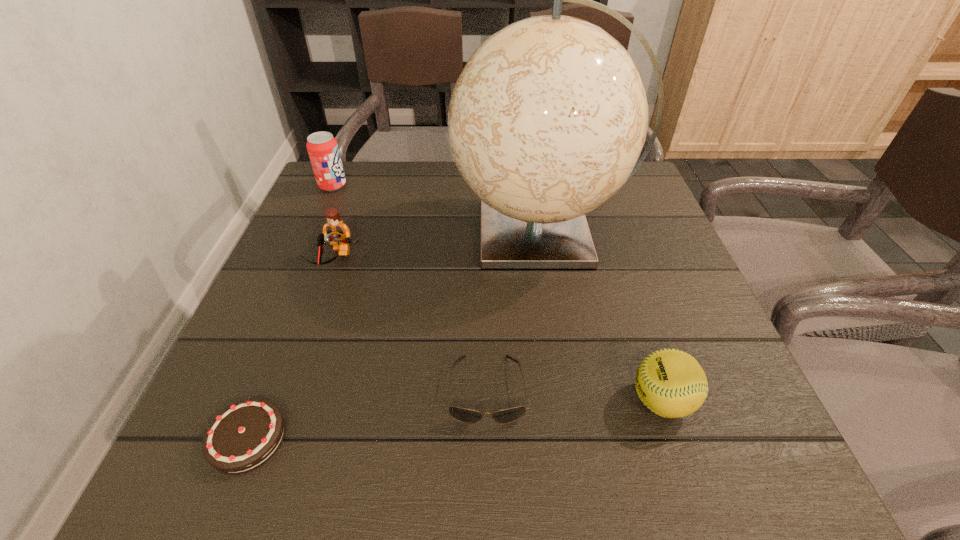
Locate an element on the screen. Image resolution: width=960 pixels, height=540 pixels. vacant space at the far edge of the desktop is located at coordinates (438, 176).

You are a GUI agent. You are given a task and a screenshot of the screen. Output one action in this format:
    pyautogui.click(x=<x>, y=<y>)
    Task: Click on the vacant region at the near edge of the desktop
    
    Given the screenshot: What is the action you would take?
    pyautogui.click(x=490, y=447)

Where is `free space at the left edge of the desktop`? This screenshot has height=540, width=960. free space at the left edge of the desktop is located at coordinates (285, 275).

At what (x,y) coordinates should I click in order to perform the action: click on vacant space at the right edge of the desktop. Please return your answer as a coordinate pair (x, y). The image size is (960, 540). Looking at the image, I should click on (629, 249).

Identify the location of vacant space at the far left corner of the desktop. (362, 199).

Find the location of a particular element. This screenshot has height=540, width=960. vacant space at the near left corner of the desktop is located at coordinates (191, 476).

Where is `free space at the far right corner of the desktop`? This screenshot has height=540, width=960. free space at the far right corner of the desktop is located at coordinates (652, 199).

At what (x,y) coordinates should I click in order to perform the action: click on vacant space at the near right corner of the desktop. Please return your answer as a coordinate pair (x, y). Looking at the image, I should click on (740, 464).

Image resolution: width=960 pixels, height=540 pixels. In order to click on vacant area between the softball and the second shortest object in this screenshot , I will do `click(574, 395)`.

Find the location of a particular element. The image size is (960, 540). unoccupied position between the second tallest object and the second shortest object is located at coordinates (410, 288).